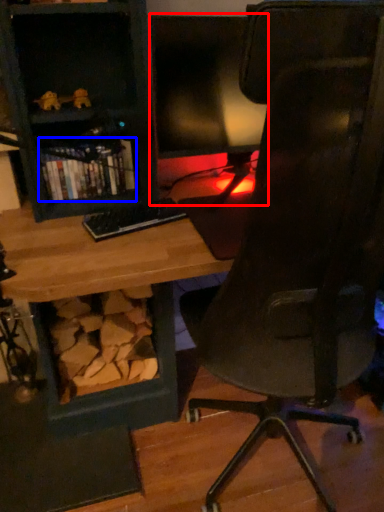
Question: Which of the following is the closest to the observer, computer monitor (highlighted by a red box) or book (highlighted by a blue box)?

Choices:
 (A) computer monitor
 (B) book

Answer: (A)